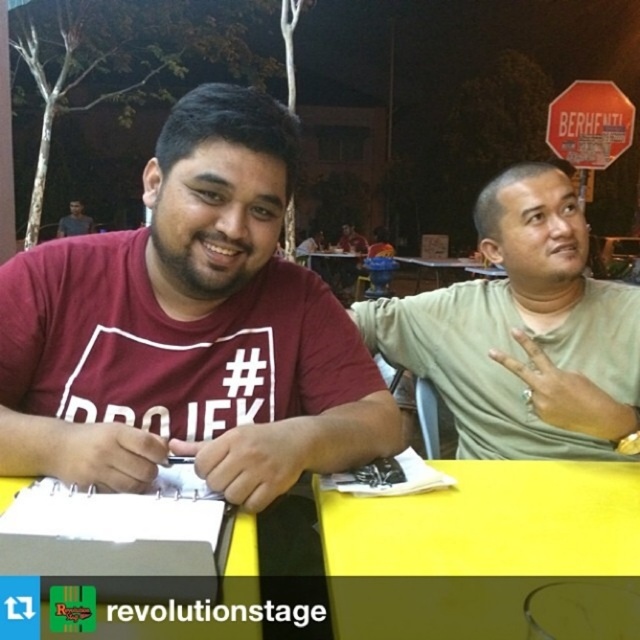
Question: Which object appears closest to the camera in this image?

Choices:
 (A) orange matte stop sign at upper right
 (B) yellow plastic table at center
 (C) matte khaki shirt at right

Answer: (C)

Question: Does maroon t-shirt at center appear on the right side of yellow matte table at center?

Choices:
 (A) yes
 (B) no

Answer: (B)

Question: Which of the following is the farthest from the observer?

Choices:
 (A) (557, 138)
 (B) (515, 637)
 (C) (227, 164)

Answer: (A)

Question: Is maroon t-shirt at center wider than matte black shirt at upper left?

Choices:
 (A) no
 (B) yes

Answer: (A)

Question: Among these points, which one is farthest from the camera?

Choices:
 (A) (586, 152)
 (B) (237, 209)
 (C) (595, 480)

Answer: (A)

Question: Does yellow matte table at center have a larger size compared to orange matte stop sign at upper right?

Choices:
 (A) no
 (B) yes

Answer: (A)